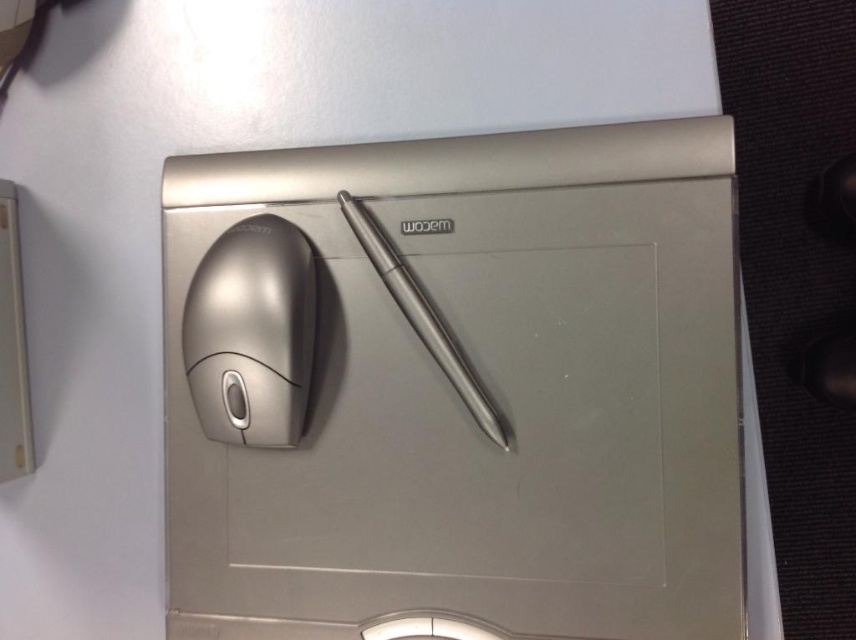
Consider the image. Is satin silver mouse at center thinner than satin silver mouse at left?

In fact, satin silver mouse at center might be wider than satin silver mouse at left.

Can you confirm if satin silver mouse at center is positioned below satin silver mouse at left?

Yes, satin silver mouse at center is below satin silver mouse at left.

Which is behind, point (610, 458) or point (242, 349)?

The point (242, 349) is more distant.

Find the location of a particular element. The height and width of the screenshot is (640, 856). satin silver mouse at center is located at coordinates (486, 388).

Who is lower down, satin silver mouse at center or satin silver pen at center?

satin silver mouse at center is lower down.

Between satin silver mouse at center and satin silver pen at center, which one appears on the right side from the viewer's perspective?

From the viewer's perspective, satin silver mouse at center appears more on the right side.

Where is `satin silver mouse at center`? The image size is (856, 640). satin silver mouse at center is located at coordinates (486, 388).

Is satin silver mouse at left above satin silver pen at center?

No, satin silver mouse at left is not above satin silver pen at center.

Can you confirm if satin silver mouse at left is shorter than satin silver pen at center?

Indeed, satin silver mouse at left has a lesser height compared to satin silver pen at center.

Image resolution: width=856 pixels, height=640 pixels. Find the location of `satin silver mouse at left`. satin silver mouse at left is located at coordinates (251, 333).